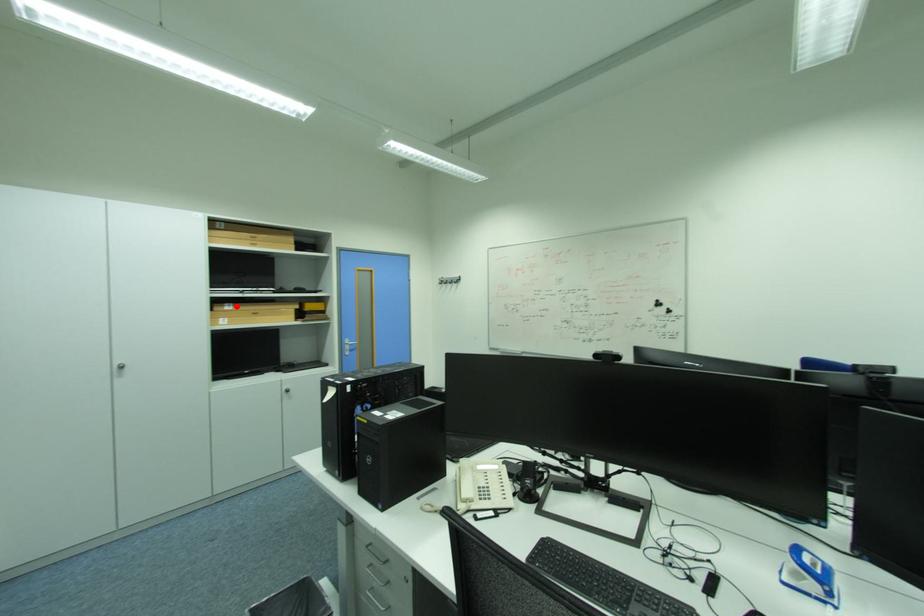
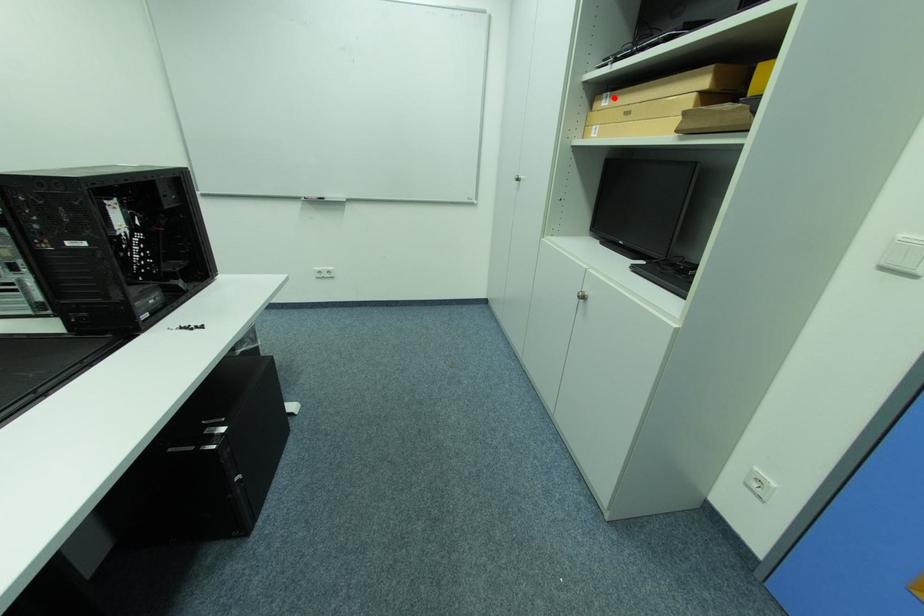
I am providing you with two images of the same scene from different viewpoints. A red point is marked on the first image and another point is marked on the second image. Is the red point in image1 aligned with the point shown in image2?

Yes